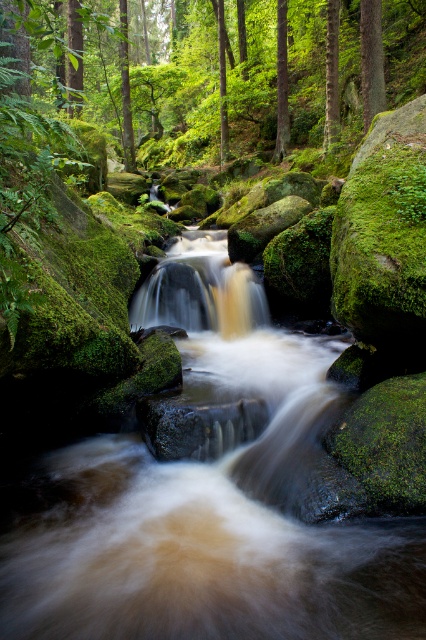
You are a hiker trying to navigate through the forest. You see the green rough bark tree at upper center and the brown textured tree at center. Which tree has a wider trunk?

The green rough bark tree at upper center has a wider trunk than the brown textured tree at center, as its width surpasses the latter.

You are a hiker who wants to cross the stream safely. The green mossy rocks at center are positioned at coordinates point 0.134, 0.418. Are these rocks suitable for stepping on to cross the stream?

The green mossy rocks at center are located at point (x=178, y=84). However, moss on rocks can be slippery, so stepping on them may be dangerous. It is advisable to look for rocks without moss or alternative safe paths for crossing the stream.